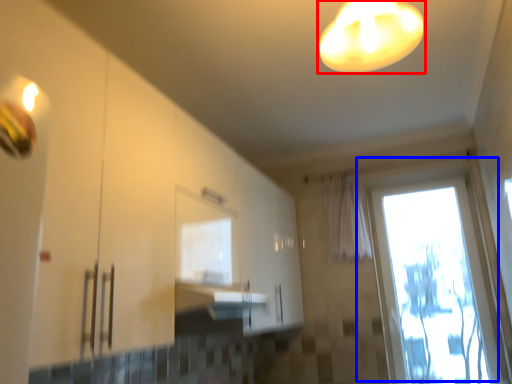
Question: Which point is further to the camera, lamp (highlighted by a red box) or window (highlighted by a blue box)?

Choices:
 (A) lamp
 (B) window

Answer: (B)